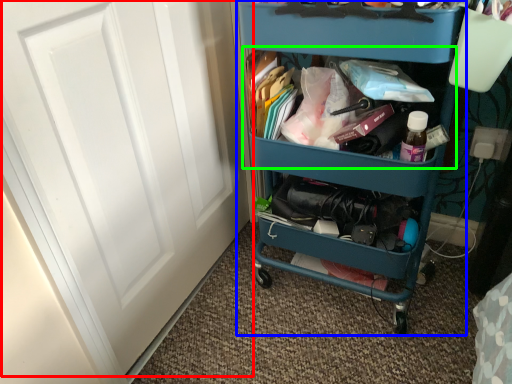
Question: Considering the real-world distances, which object is farthest from door (highlighted by a red box)? furniture (highlighted by a blue box) or cabinet (highlighted by a green box)?

Choices:
 (A) furniture
 (B) cabinet

Answer: (B)